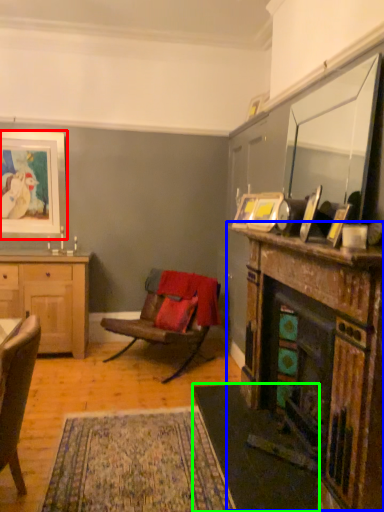
Question: Estimate the real-world distances between objects in this image. Which object is closer to picture frame (highlighted by a red box), fireplace (highlighted by a blue box) or carpets (highlighted by a green box)?

Choices:
 (A) fireplace
 (B) carpets

Answer: (B)